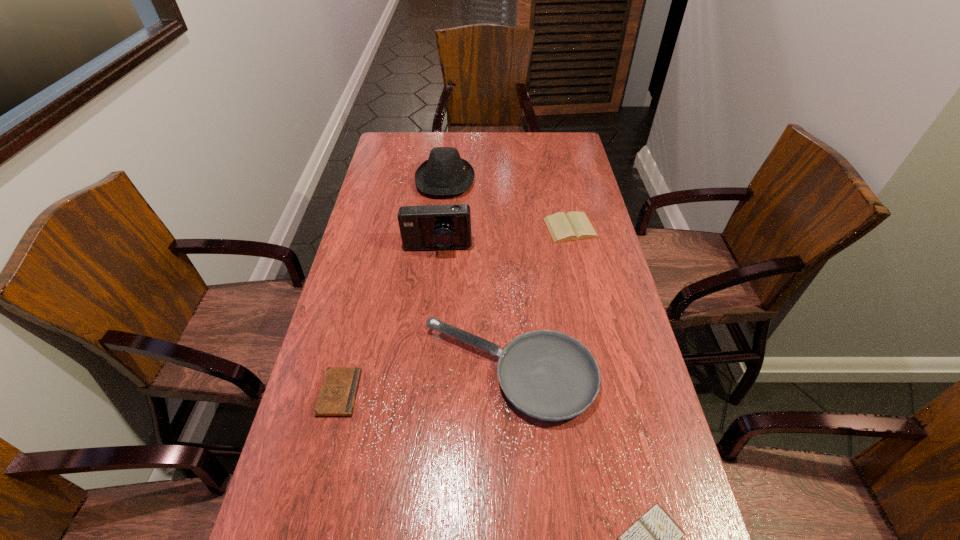
Find the location of a particular element. The width and height of the screenshot is (960, 540). vacant area situated 0.210m on the front of the fourth shortest object is located at coordinates tap(517, 525).

The height and width of the screenshot is (540, 960). Find the location of `free region located 0.120m on the left of the third shortest object`. free region located 0.120m on the left of the third shortest object is located at coordinates (510, 228).

At what (x,y) coordinates should I click in order to perform the action: click on vacant area situated 0.380m on the spine side of the leftmost diary. Please return your answer as a coordinate pair (x, y). Looking at the image, I should click on (510, 393).

The image size is (960, 540). Find the location of `object that is at the left edge`. object that is at the left edge is located at coordinates (338, 392).

Where is `frying pan that is at the right edge`? frying pan that is at the right edge is located at coordinates (548, 375).

This screenshot has width=960, height=540. I want to click on diary that is at the right edge, so click(x=573, y=226).

Identify the location of vacant area at the far edge. (496, 155).

In the image, there is a desktop. Identify the location of free space at the left edge. The height and width of the screenshot is (540, 960). pyautogui.click(x=385, y=175).

You are a GUI agent. You are given a task and a screenshot of the screen. Output one action in this format:
    pyautogui.click(x=<x>, y=<y>)
    Task: Click on the vacant space at the right edge
    
    Given the screenshot: What is the action you would take?
    pyautogui.click(x=583, y=169)

Image resolution: width=960 pixels, height=540 pixels. I want to click on vacant region at the far left corner of the desktop, so click(x=386, y=137).